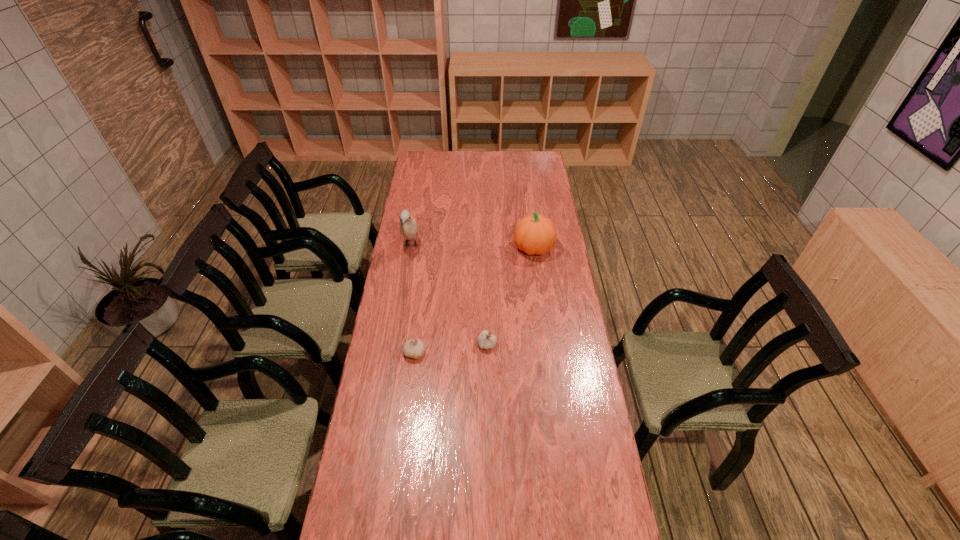
The image size is (960, 540). Identify the location of bird that is at the left edge. (408, 227).

What are the coordinates of `garlic situated at the left edge` in the screenshot? It's located at (414, 348).

Locate an element on the screen. The image size is (960, 540). object that is positioned at the right edge is located at coordinates (535, 234).

Find the location of a particular element. The width and height of the screenshot is (960, 540). vacant space at the far edge of the desktop is located at coordinates (511, 159).

This screenshot has height=540, width=960. I want to click on vacant space at the left edge of the desktop, so click(x=402, y=251).

Where is `free spot at the right edge of the desktop`? The width and height of the screenshot is (960, 540). free spot at the right edge of the desktop is located at coordinates (550, 257).

The image size is (960, 540). In the image, there is a desktop. Identify the location of vacant space at the far left corner. (421, 169).

Locate an element on the screen. free location at the far right corner of the desktop is located at coordinates (541, 165).

Find the location of a particular element. The height and width of the screenshot is (540, 960). vacant area that lies between the taller garlic and the leftmost object is located at coordinates (449, 295).

At what (x,y) coordinates should I click in order to perform the action: click on unoccupied position between the third object from right to left and the bird. Please return your answer as a coordinate pair (x, y). The image size is (960, 540). Looking at the image, I should click on 413,299.